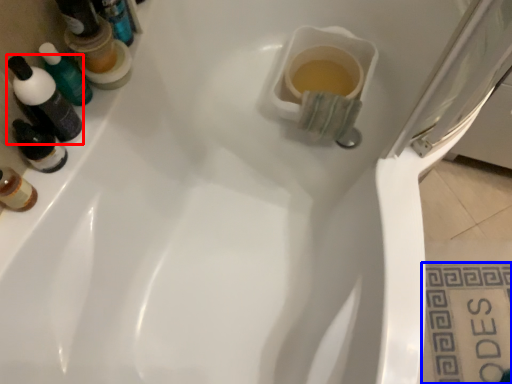
Question: Among these objects, which one is nearest to the camera, mouthwash (highlighted by a red box) or tile (highlighted by a blue box)?

Choices:
 (A) mouthwash
 (B) tile

Answer: (A)